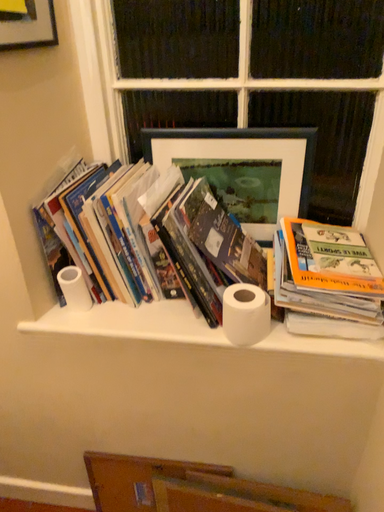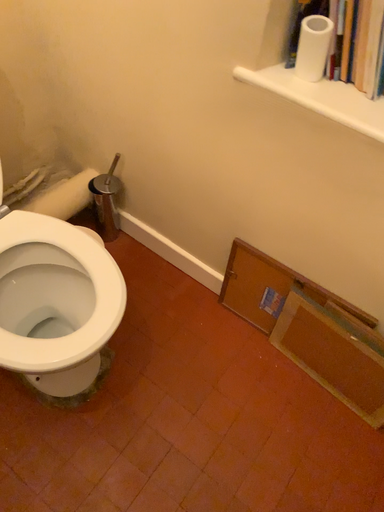
Question: Which way did the camera rotate in the video?

Choices:
 (A) rotated right
 (B) rotated left

Answer: (B)